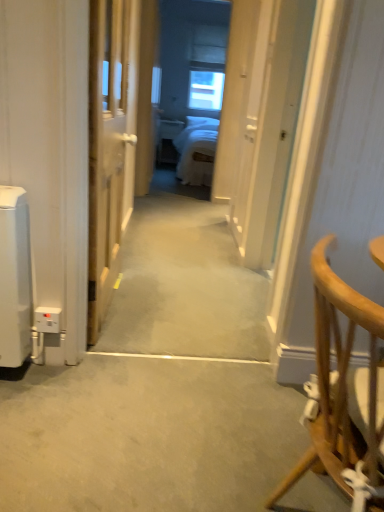
Where is `free spot above gray carpet at center, acting as the first path starting from the bottom (from a real-world perspective)`? The height and width of the screenshot is (512, 384). free spot above gray carpet at center, acting as the first path starting from the bottom (from a real-world perspective) is located at coordinates (163, 403).